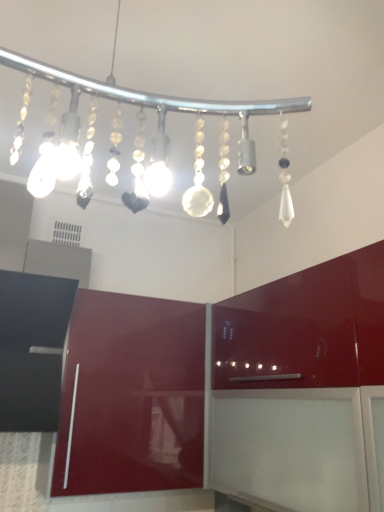
What are the coordinates of `clear glass chandelier at upper center` in the screenshot? It's located at (147, 153).

Considering the positions of objects glossy red cabinet at center, which is counted as the 2th cabinetry, starting from the left, and clear glass chandelier at upper center in the image provided, who is more to the right, glossy red cabinet at center, which is counted as the 2th cabinetry, starting from the left, or clear glass chandelier at upper center?

Positioned to the right is glossy red cabinet at center, which is counted as the 2th cabinetry, starting from the left.

From a real-world perspective, which is physically below, glossy red cabinet at center, which is counted as the 2th cabinetry, starting from the left, or clear glass chandelier at upper center?

glossy red cabinet at center, which is counted as the 2th cabinetry, starting from the left, from a real-world perspective.

Looking at the image, does glossy red cabinet at center, the first cabinetry positioned from the right, seem bigger or smaller compared to clear glass chandelier at upper center?

Clearly, glossy red cabinet at center, the first cabinetry positioned from the right, is larger in size than clear glass chandelier at upper center.

Considering the relative positions of clear glass chandelier at upper center and glossy burgundy cabinet at lower left, the 1th cabinetry in the left-to-right sequence, in the image provided, is clear glass chandelier at upper center to the left or to the right of glossy burgundy cabinet at lower left, the 1th cabinetry in the left-to-right sequence,?

From the image, it's evident that clear glass chandelier at upper center is to the right of glossy burgundy cabinet at lower left, the 1th cabinetry in the left-to-right sequence.

From a real-world perspective, between clear glass chandelier at upper center and glossy burgundy cabinet at lower left, which is counted as the 2th cabinetry, starting from the right, who is vertically lower?

From a 3D spatial view, glossy burgundy cabinet at lower left, which is counted as the 2th cabinetry, starting from the right, is below.

Is glossy red cabinet at center, which is counted as the 2th cabinetry, starting from the left, bigger than glossy burgundy cabinet at lower left, which is counted as the 2th cabinetry, starting from the right?

Indeed, glossy red cabinet at center, which is counted as the 2th cabinetry, starting from the left, has a larger size compared to glossy burgundy cabinet at lower left, which is counted as the 2th cabinetry, starting from the right.

Who is taller, glossy red cabinet at center, the first cabinetry positioned from the right, or glossy burgundy cabinet at lower left, which is counted as the 2th cabinetry, starting from the right?

Standing taller between the two is glossy burgundy cabinet at lower left, which is counted as the 2th cabinetry, starting from the right.

Considering the points (69, 442) and (158, 380), which point is behind, point (69, 442) or point (158, 380)?

The point (158, 380) is more distant.

From the picture: In the image, is glossy burgundy cabinet at lower left, which is counted as the 2th cabinetry, starting from the right, positioned in front of or behind clear glass chandelier at upper center?

Clearly, glossy burgundy cabinet at lower left, which is counted as the 2th cabinetry, starting from the right, is behind clear glass chandelier at upper center.

Is glossy burgundy cabinet at lower left, which is counted as the 2th cabinetry, starting from the right, not within clear glass chandelier at upper center?

Yes.

From the image's perspective, is glossy burgundy cabinet at lower left, the 1th cabinetry in the left-to-right sequence, below clear glass chandelier at upper center?

Yes, from the image's perspective, glossy burgundy cabinet at lower left, the 1th cabinetry in the left-to-right sequence, is below clear glass chandelier at upper center.

Consider the image. From a real-world perspective, is glossy burgundy cabinet at lower left, which is counted as the 2th cabinetry, starting from the right, above or below glossy red cabinet at center, the first cabinetry positioned from the right?

glossy burgundy cabinet at lower left, which is counted as the 2th cabinetry, starting from the right, is situated lower than glossy red cabinet at center, the first cabinetry positioned from the right, in the real world.

Would you say glossy burgundy cabinet at lower left, the 1th cabinetry in the left-to-right sequence, is to the left or to the right of glossy red cabinet at center, which is counted as the 2th cabinetry, starting from the left, in the picture?

glossy burgundy cabinet at lower left, the 1th cabinetry in the left-to-right sequence, is to the left of glossy red cabinet at center, which is counted as the 2th cabinetry, starting from the left.

Can we say glossy burgundy cabinet at lower left, the 1th cabinetry in the left-to-right sequence, lies outside glossy red cabinet at center, the first cabinetry positioned from the right?

glossy burgundy cabinet at lower left, the 1th cabinetry in the left-to-right sequence, is positioned outside glossy red cabinet at center, the first cabinetry positioned from the right.

Starting from the clear glass chandelier at upper center, which cabinetry is the 1st one behind? Please provide its 2D coordinates.

[(229, 390)]

Is clear glass chandelier at upper center positioned far away from glossy red cabinet at center, the first cabinetry positioned from the right?

They are positioned close to each other.

Does clear glass chandelier at upper center have a greater height compared to glossy red cabinet at center, which is counted as the 2th cabinetry, starting from the left?

In fact, clear glass chandelier at upper center may be shorter than glossy red cabinet at center, which is counted as the 2th cabinetry, starting from the left.

Relative to glossy red cabinet at center, which is counted as the 2th cabinetry, starting from the left, is clear glass chandelier at upper center in front or behind?

clear glass chandelier at upper center is in front of glossy red cabinet at center, which is counted as the 2th cabinetry, starting from the left.

Locate an element on the screen. The image size is (384, 512). the 1st cabinetry positioned below the clear glass chandelier at upper center (from a real-world perspective) is located at coordinates (229, 390).

Locate an element on the screen. This screenshot has width=384, height=512. chandelier on the right of the glossy burgundy cabinet at lower left, which is counted as the 2th cabinetry, starting from the right is located at coordinates (147, 153).

Considering their positions, is glossy red cabinet at center, the first cabinetry positioned from the right, positioned further to clear glass chandelier at upper center than glossy burgundy cabinet at lower left, which is counted as the 2th cabinetry, starting from the right?

glossy burgundy cabinet at lower left, which is counted as the 2th cabinetry, starting from the right, is positioned further to the anchor clear glass chandelier at upper center.

Based on the photo, looking at the image, which one is located closer to glossy burgundy cabinet at lower left, which is counted as the 2th cabinetry, starting from the right, glossy red cabinet at center, the first cabinetry positioned from the right, or clear glass chandelier at upper center?

Based on the image, glossy red cabinet at center, the first cabinetry positioned from the right, appears to be nearer to glossy burgundy cabinet at lower left, which is counted as the 2th cabinetry, starting from the right.

Looking at the image, which one is located closer to glossy burgundy cabinet at lower left, which is counted as the 2th cabinetry, starting from the right, clear glass chandelier at upper center or glossy red cabinet at center, which is counted as the 2th cabinetry, starting from the left?

glossy red cabinet at center, which is counted as the 2th cabinetry, starting from the left.

Based on their spatial positions, is glossy burgundy cabinet at lower left, which is counted as the 2th cabinetry, starting from the right, or clear glass chandelier at upper center closer to glossy red cabinet at center, which is counted as the 2th cabinetry, starting from the left?

Based on the image, glossy burgundy cabinet at lower left, which is counted as the 2th cabinetry, starting from the right, appears to be nearer to glossy red cabinet at center, which is counted as the 2th cabinetry, starting from the left.

Which object lies nearer to the anchor point glossy red cabinet at center, the first cabinetry positioned from the right, clear glass chandelier at upper center or glossy burgundy cabinet at lower left, the 1th cabinetry in the left-to-right sequence?

glossy burgundy cabinet at lower left, the 1th cabinetry in the left-to-right sequence.

From the image, which object appears to be nearer to clear glass chandelier at upper center, glossy burgundy cabinet at lower left, which is counted as the 2th cabinetry, starting from the right, or glossy red cabinet at center, the first cabinetry positioned from the right?

glossy red cabinet at center, the first cabinetry positioned from the right.

This screenshot has width=384, height=512. Identify the location of cabinetry between clear glass chandelier at upper center and glossy burgundy cabinet at lower left, the 1th cabinetry in the left-to-right sequence, in the vertical direction. (229, 390).